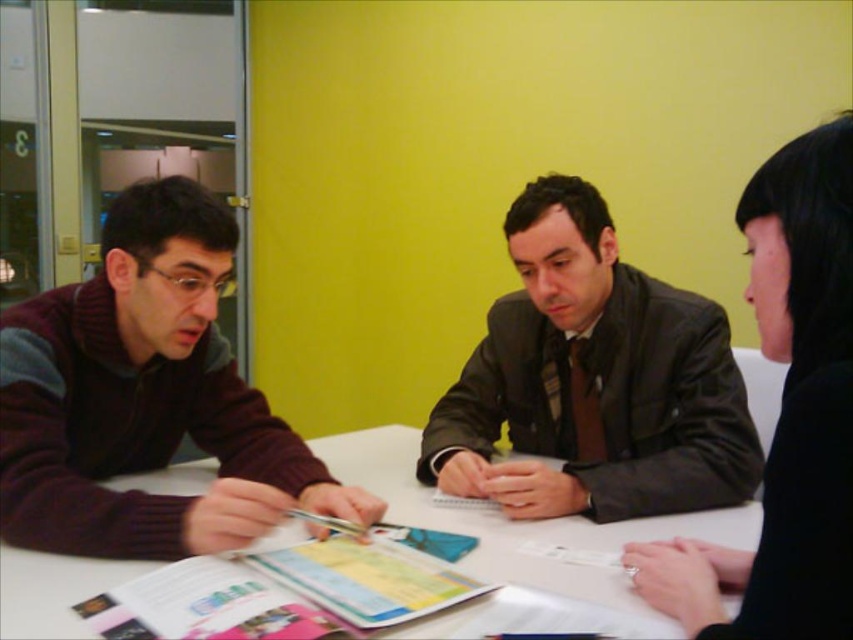
Who is positioned more to the left, black matte hair at upper right or white paper at center?

From the viewer's perspective, white paper at center appears more on the left side.

Is black matte hair at upper right smaller than white paper at center?

Yes, black matte hair at upper right is smaller than white paper at center.

Does point (822, 600) come farther from viewer compared to point (349, 436)?

No.

Identify the location of black matte hair at upper right. This screenshot has width=853, height=640. tap(786, 416).

Which is above, maroon sweater at left or white paper at center?

maroon sweater at left is higher up.

Does point (163, 388) come farther from viewer compared to point (57, 595)?

Yes, it is behind point (57, 595).

Where is `maroon sweater at left`? This screenshot has height=640, width=853. maroon sweater at left is located at coordinates (144, 397).

Consider the image. Does maroon sweater at left appear under dark brown leather jacket at center?

Correct, maroon sweater at left is located below dark brown leather jacket at center.

Who is lower down, maroon sweater at left or dark brown leather jacket at center?

maroon sweater at left is below.

Identify the location of maroon sweater at left. (144, 397).